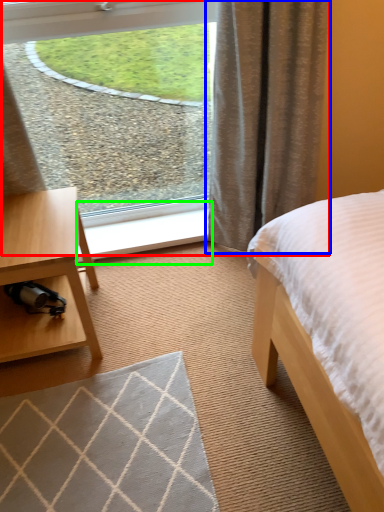
Question: Based on their relative distances, which object is farther from window (highlighted by a red box)? Choose from curtain (highlighted by a blue box) and window sill (highlighted by a green box).

Choices:
 (A) curtain
 (B) window sill

Answer: (B)